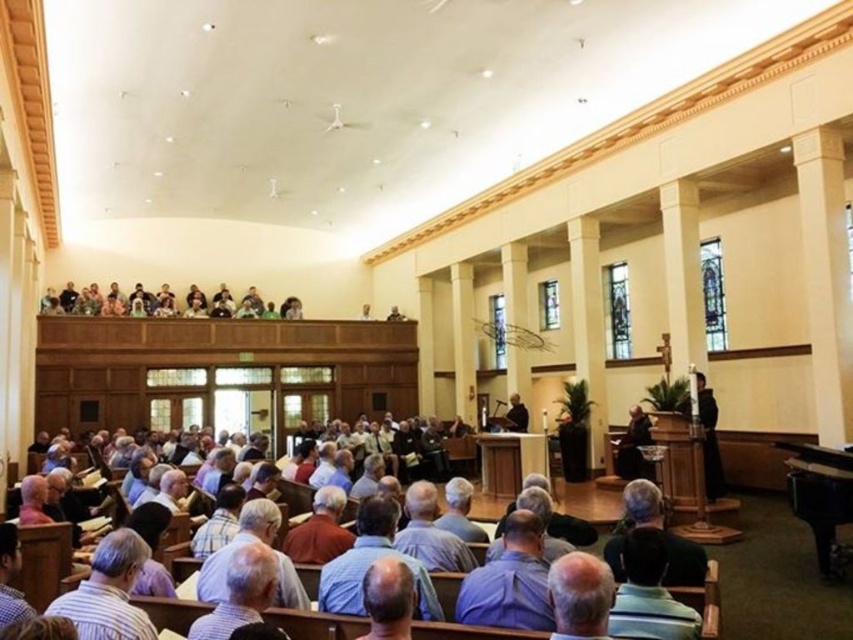
Question: Is light brown wooden pews at lower center wider than black smooth pulpit at center?

Choices:
 (A) no
 (B) yes

Answer: (A)

Question: Which point is closer to the camera?

Choices:
 (A) (68, 588)
 (B) (521, 403)

Answer: (A)

Question: Where is light brown wooden pews at lower center located in relation to black smooth pulpit at center in the image?

Choices:
 (A) above
 (B) below

Answer: (A)

Question: Which point is farther to the camera?

Choices:
 (A) (525, 419)
 (B) (676, 596)

Answer: (A)

Question: Does light brown wooden pews at lower center come in front of black smooth pulpit at center?

Choices:
 (A) no
 (B) yes

Answer: (B)